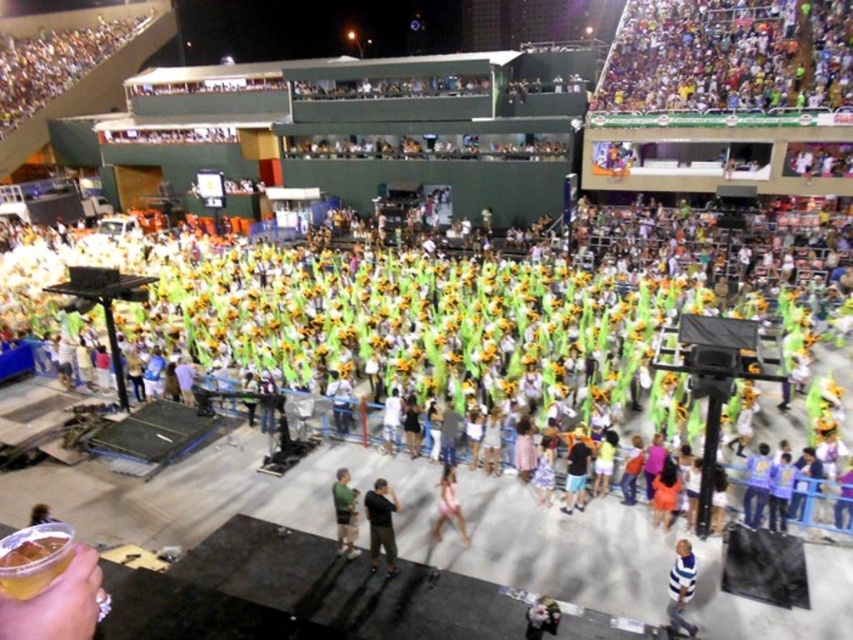
You are a photographer at the event and want to capture both the black matte shirt at center and the pink fabric dress at center in a single shot. Given that your camera has a minimum focus distance of 2 meters, will you be able to take the photo without moving closer?

The black matte shirt at center and pink fabric dress at center are 1.88 meters apart from each other, which is less than the camera minimum focus distance of 2 meters. Therefore, you can take the photo without moving closer.

You are a photographer at the event and want to capture both the blue striped shirt at lower right and the green fabric shirt at center in a single photo. Considering their heights, which one might appear smaller in the photo?

The blue striped shirt at lower right has a lesser height compared to the green fabric shirt at center, so it will appear smaller in the photo.